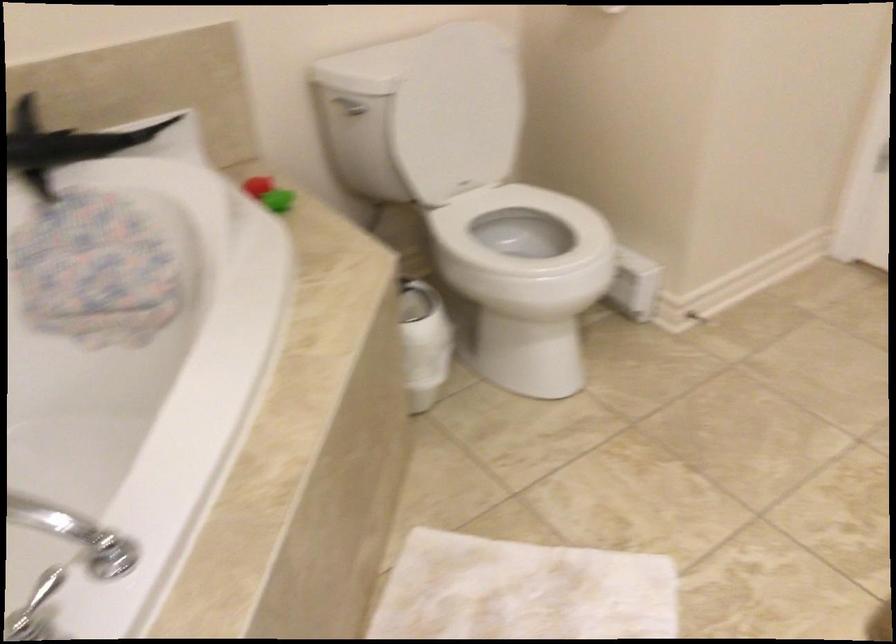
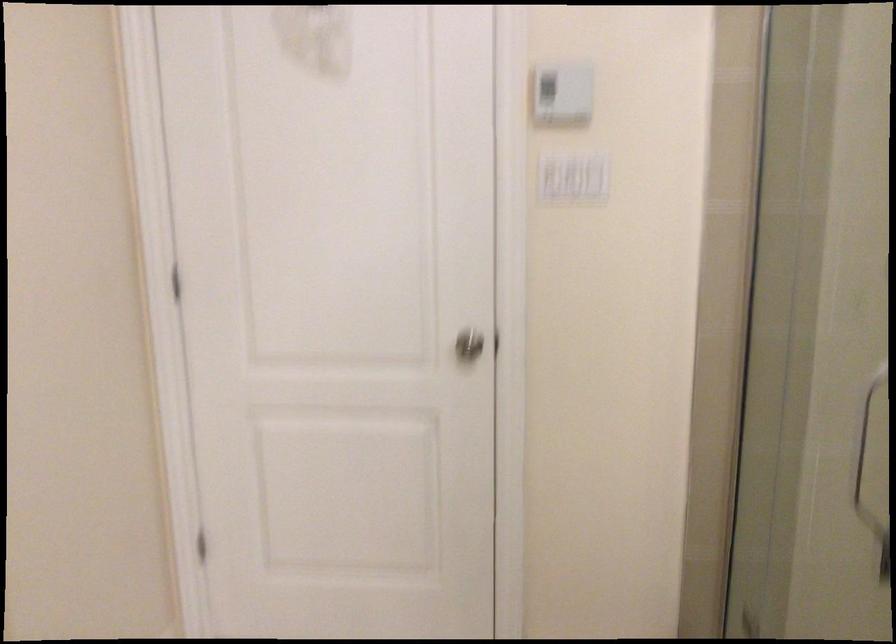
Question: The images are taken continuously from a first-person perspective. In which direction is your viewpoint rotating?

Choices:
 (A) Left
 (B) Right
 (C) Up
 (D) Down

Answer: (B)